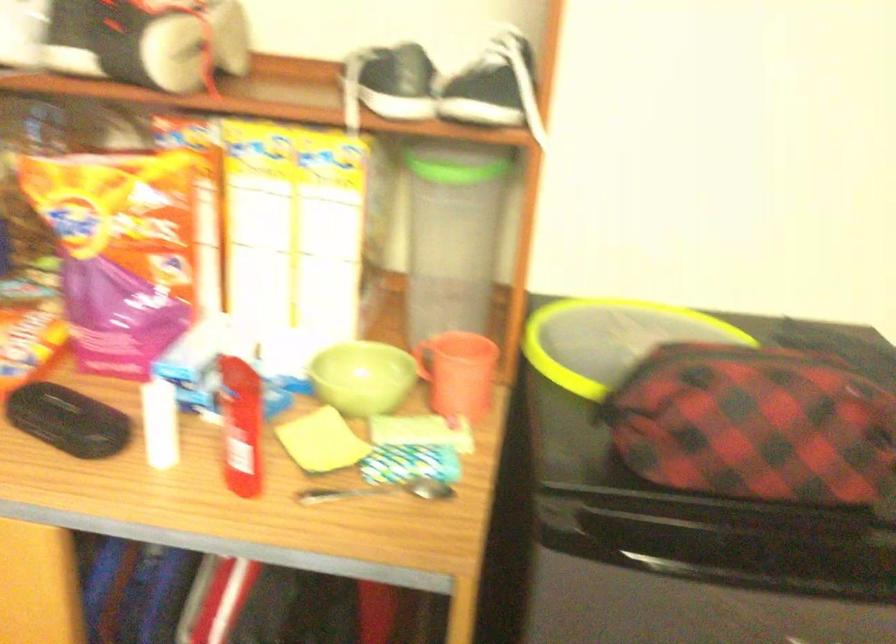
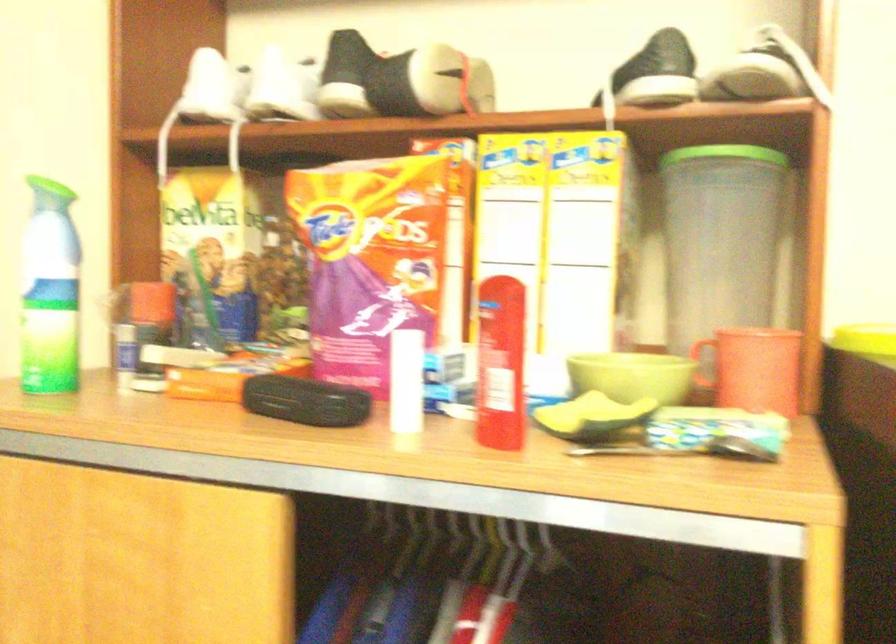
The point at (161, 431) is marked in the first image. Where is the corresponding point in the second image?

(407, 386)